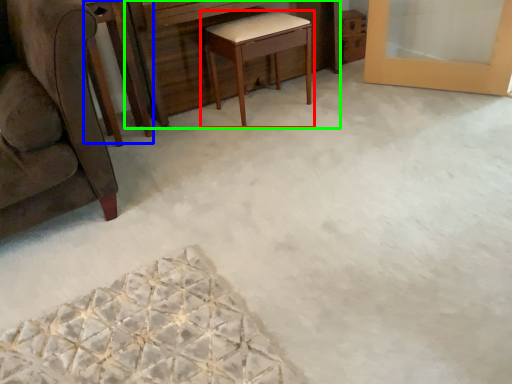
Question: Which is farther away from table (highlighted by a red box)? round table (highlighted by a blue box) or vanity (highlighted by a green box)?

Choices:
 (A) round table
 (B) vanity

Answer: (A)